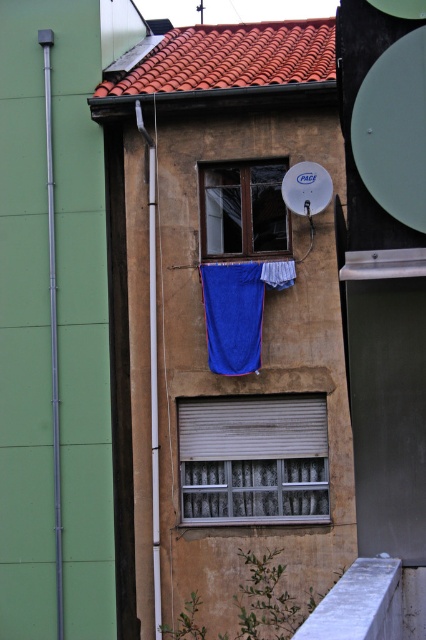
Question: Which point is closer to the camera?

Choices:
 (A) (284, 284)
 (B) (273, 468)

Answer: (A)

Question: Is wooden window at center closer to camera compared to blue fabric curtain at center?

Choices:
 (A) no
 (B) yes

Answer: (A)

Question: Can you confirm if metallic silver window at center is wider than blue fabric curtain at center?

Choices:
 (A) yes
 (B) no

Answer: (A)

Question: Based on their relative distances, which object is farther from the blue fabric at center?

Choices:
 (A) metallic silver window at center
 (B) wooden window at center
 (C) blue fabric curtain at center

Answer: (A)

Question: Does metallic silver window at center have a larger size compared to wooden window at center?

Choices:
 (A) yes
 (B) no

Answer: (A)

Question: Which of the following is the farthest from the observer?

Choices:
 (A) (294, 269)
 (B) (215, 307)
 (C) (262, 506)
 (D) (273, 209)

Answer: (D)